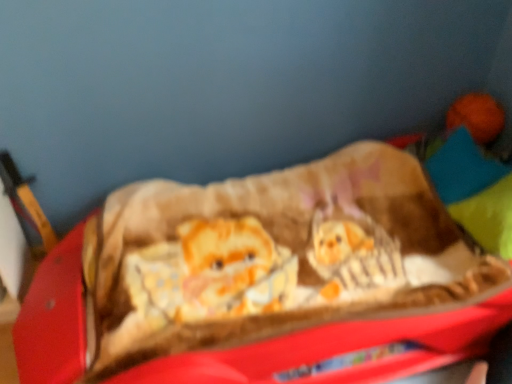
Question: Should I look upward or downward to see brown plush dog bed at center?

Choices:
 (A) up
 (B) down

Answer: (B)